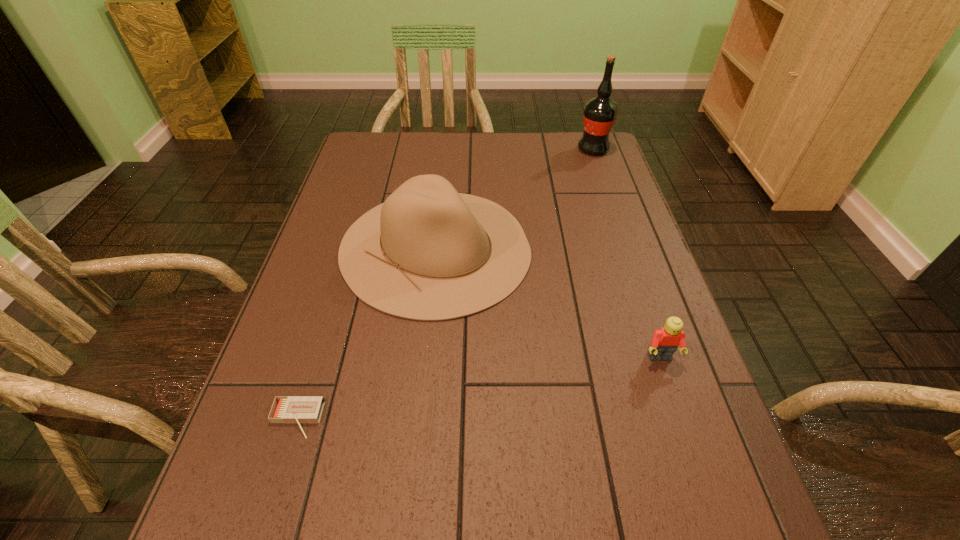
This screenshot has height=540, width=960. In order to click on the rightmost yellow sunflower in this screenshot , I will do `click(654, 401)`.

Where is `free space located on the front-facing side of the tallest object`? free space located on the front-facing side of the tallest object is located at coordinates (560, 178).

In order to click on vacant area located 0.230m on the front-facing side of the third smallest yellow sunflower in this screenshot , I will do `click(437, 200)`.

In order to click on vacant area situated 0.390m on the front-facing side of the third smallest yellow sunflower in this screenshot , I will do `click(387, 200)`.

Find the location of `vacant space located on the front-facing side of the third smallest yellow sunflower`. vacant space located on the front-facing side of the third smallest yellow sunflower is located at coordinates (489, 200).

Identify the location of free region located 0.290m on the face of the farther green sunflower. The width and height of the screenshot is (960, 540). click(x=372, y=279).

Find the location of a particular element. Image resolution: width=960 pixels, height=540 pixels. free spot located 0.100m on the face of the farther green sunflower is located at coordinates (446, 279).

What are the coordinates of `vacant space located on the face of the farther green sunflower` in the screenshot? It's located at (365, 279).

Find the location of a particular element. free space located 0.050m on the face of the nearer green sunflower is located at coordinates (572, 310).

Image resolution: width=960 pixels, height=540 pixels. I want to click on vacant area situated on the face of the nearer green sunflower, so click(443, 310).